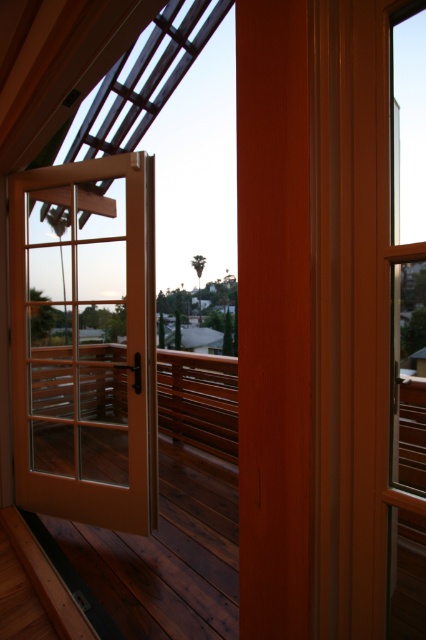
Which is behind, point (149, 332) or point (175, 419)?

Point (175, 419)

Who is more distant from viewer, (118, 492) or (212, 429)?

The point (212, 429) is more distant.

The image size is (426, 640). In order to click on matte glass door at center in this screenshot , I will do `click(85, 340)`.

Locate an element on the screen. dark brown wood at center is located at coordinates (152, 532).

Can you confirm if dark brown wood at center is positioned to the left of clear glass door at center?

A: Indeed, dark brown wood at center is positioned on the left side of clear glass door at center.

Which is in front, point (201, 376) or point (190, 392)?

Point (201, 376) is more forward.

You are a GUI agent. You are given a task and a screenshot of the screen. Output one action in this format:
    pyautogui.click(x=<x>, y=<y>)
    Task: Click on the dark brown wood at center
    
    Given the screenshot: What is the action you would take?
    pyautogui.click(x=152, y=532)

Is point (78, 212) positioned after point (166, 365)?

No, it is in front of (166, 365).

Between matte glass door at center and dark brown wood at center, which one appears on the right side from the viewer's perspective?

Positioned to the right is dark brown wood at center.

What do you see at coordinates (85, 340) in the screenshot?
I see `matte glass door at center` at bounding box center [85, 340].

Image resolution: width=426 pixels, height=640 pixels. I want to click on matte glass door at center, so click(x=85, y=340).